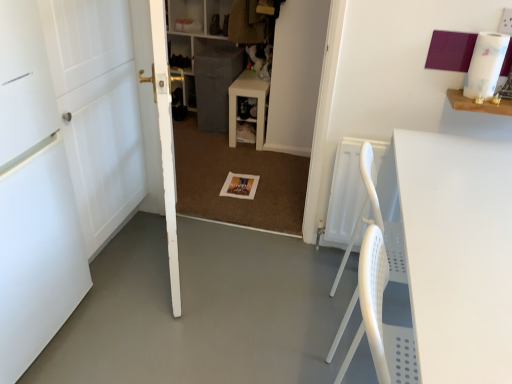
Question: Considering the relative positions of matte white table at center, arranged as the first table when viewed from the left, and gray fabric bookshelf at center in the image provided, is matte white table at center, arranged as the first table when viewed from the left, to the left or to the right of gray fabric bookshelf at center?

Choices:
 (A) right
 (B) left

Answer: (A)

Question: Would you say matte white table at center, the 2th table in the right-to-left sequence, is inside or outside gray fabric bookshelf at center?

Choices:
 (A) outside
 (B) inside

Answer: (A)

Question: Which is farther from the gray fabric bookshelf at center?

Choices:
 (A) matte white table at center, arranged as the first table when viewed from the left
 (B) white matte door at left, marked as the first door in a left-to-right arrangement
 (C) gray fabric cabinet at center
 (D) white wooden door at left, the 3th door when ordered from left to right
 (E) white matte table at right, positioned as the first table in bottom-to-top order

Answer: (B)

Question: Considering the real-world distances, which object is closest to the white matte table at right, which appears as the 1th table when viewed from the front?

Choices:
 (A) matte white table at center, the 2th table in the right-to-left sequence
 (B) white wooden door at left, the 3th door when ordered from left to right
 (C) gray fabric bookshelf at center
 (D) white matte door at left, marked as the first door in a left-to-right arrangement
 (E) white wood door at left, positioned as the 2th door in right-to-left order

Answer: (B)